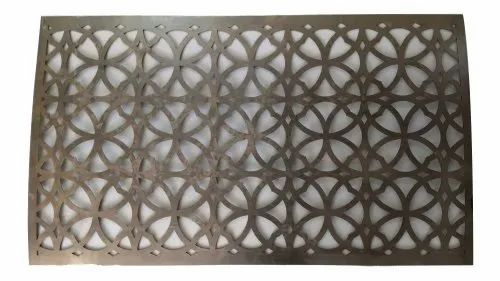
In order to click on grate in this screenshot , I will do `click(309, 144)`.